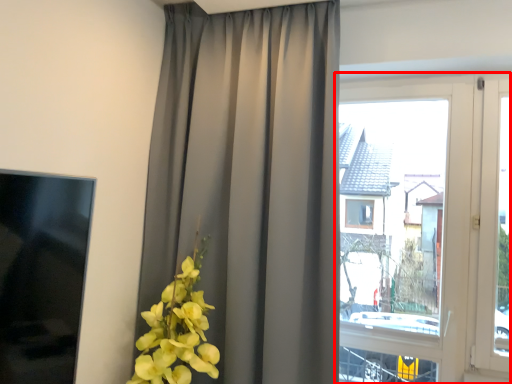
Question: Observing the image, what is the correct spatial positioning of window (annotated by the red box) in reference to curtain?

Choices:
 (A) right
 (B) left

Answer: (A)